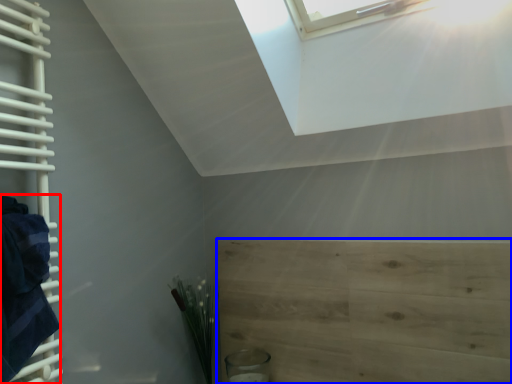
Question: Among these objects, which one is nearest to the camera, blanket (highlighted by a red box) or plywood (highlighted by a blue box)?

Choices:
 (A) blanket
 (B) plywood

Answer: (A)